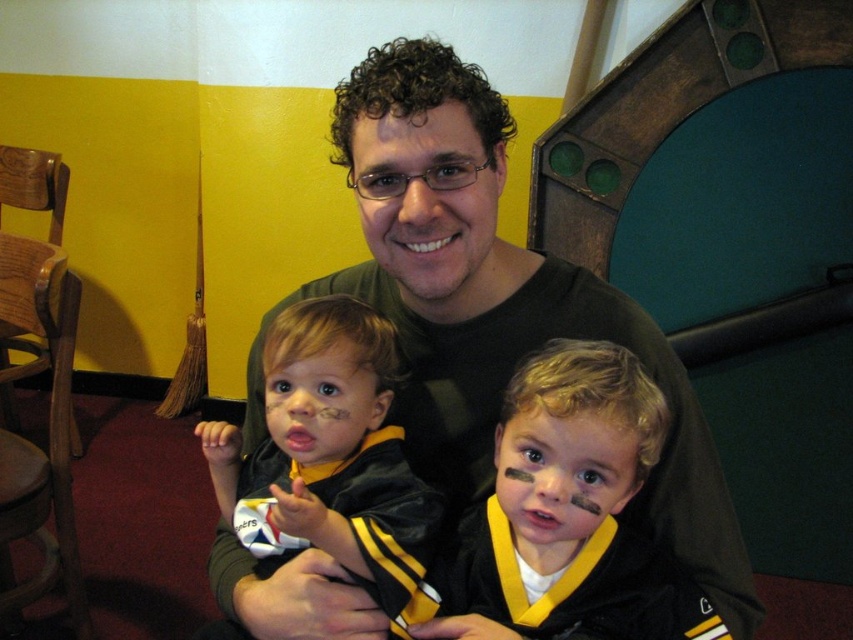
Question: Is black matte shirt at center further to camera compared to matte black jacket at center?

Choices:
 (A) yes
 (B) no

Answer: (B)

Question: Does black matte shirt at center lie in front of matte black jacket at center?

Choices:
 (A) no
 (B) yes

Answer: (B)

Question: Which of the following is the farthest from the observer?

Choices:
 (A) black matte jersey at center
 (B) matte black jacket at center
 (C) black matte shirt at center

Answer: (B)

Question: Can you confirm if black matte jersey at center is thinner than matte black jacket at center?

Choices:
 (A) no
 (B) yes

Answer: (A)

Question: Which point is closer to the camera?

Choices:
 (A) black matte shirt at center
 (B) matte black jacket at center
 (C) black matte jersey at center

Answer: (C)

Question: Which object appears closest to the camera in this image?

Choices:
 (A) black matte shirt at center
 (B) matte black jacket at center
 (C) black matte jersey at center

Answer: (C)